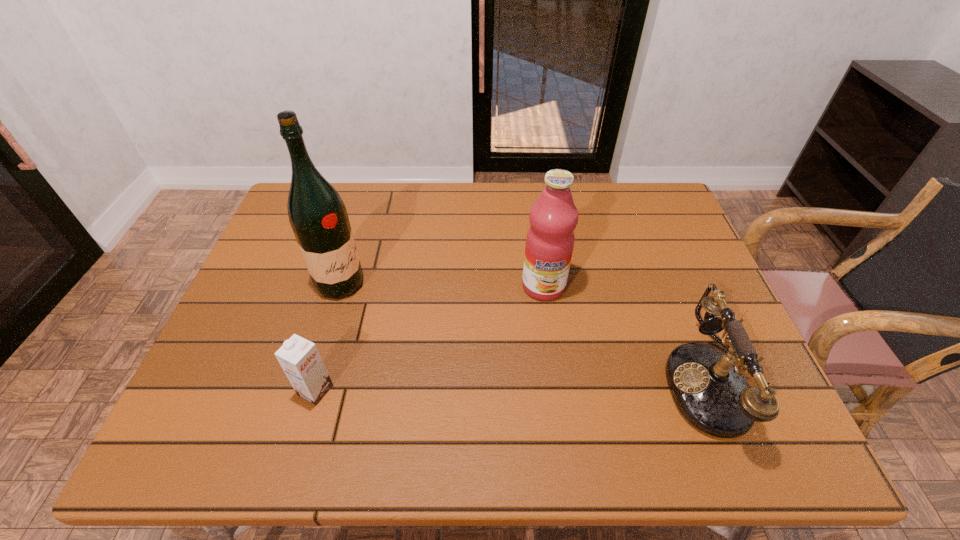
The image size is (960, 540). What are the coordinates of `chocolate milk` in the screenshot? It's located at (299, 358).

Locate an element on the screen. The height and width of the screenshot is (540, 960). the third tallest object is located at coordinates (709, 389).

The width and height of the screenshot is (960, 540). In order to click on the rightmost object in this screenshot , I will do `click(709, 389)`.

Identify the location of the third shortest object. (553, 217).

Image resolution: width=960 pixels, height=540 pixels. Find the location of `the third object from left to right`. the third object from left to right is located at coordinates (553, 217).

Where is `liquor`? The height and width of the screenshot is (540, 960). liquor is located at coordinates (318, 217).

Image resolution: width=960 pixels, height=540 pixels. In order to click on free space located 0.350m on the right of the shortest object in this screenshot , I will do `click(492, 390)`.

The width and height of the screenshot is (960, 540). Identify the location of vacant space situated 0.120m on the dial of the second shortest object. pos(611,383).

Locate an element on the screen. The height and width of the screenshot is (540, 960). free region located on the dial of the second shortest object is located at coordinates (629, 383).

Locate an element on the screen. This screenshot has height=540, width=960. vacant region located 0.350m on the dial of the second shortest object is located at coordinates point(507,383).